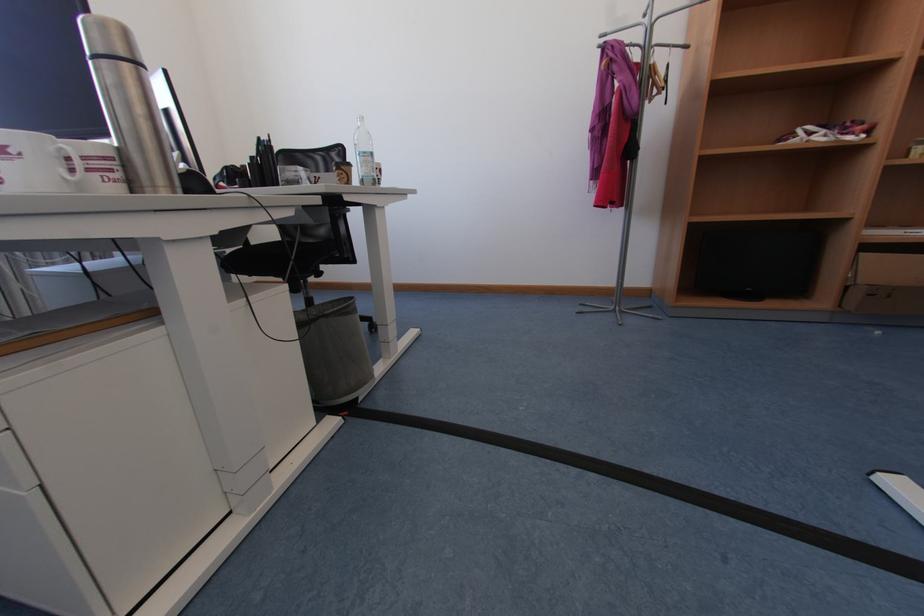
The width and height of the screenshot is (924, 616). Identify the location of mesh trash can. (334, 351).